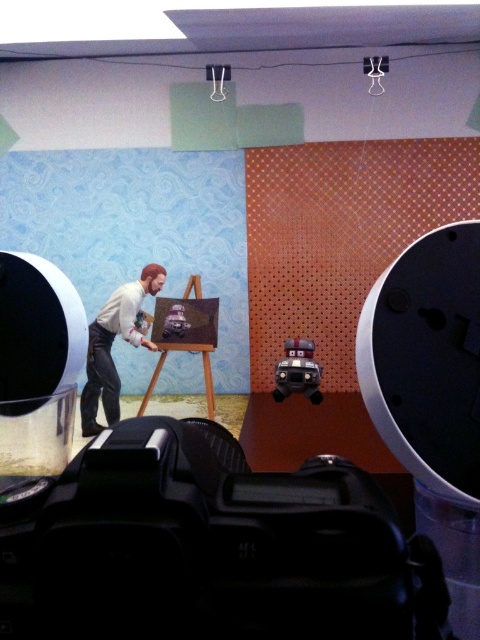
Is smooth beige shirt at center below wooden easel at center?

Incorrect, smooth beige shirt at center is not positioned below wooden easel at center.

Between point (127, 307) and point (166, 330), which one is positioned behind?

The point (166, 330) is more distant.

I want to click on smooth beige shirt at center, so click(x=110, y=346).

Does smooth beige shirt at center appear over matte black video camera at center?

Yes, smooth beige shirt at center is above matte black video camera at center.

Does smooth beige shirt at center have a larger size compared to matte black video camera at center?

Yes.

Is point (99, 376) positioned in front of point (314, 385)?

No.

You are a GUI agent. You are given a task and a screenshot of the screen. Output one action in this format:
    pyautogui.click(x=<x>, y=<y>)
    Task: Click on the smooth beige shirt at center
    The height and width of the screenshot is (640, 480).
    Given the screenshot: What is the action you would take?
    pos(110,346)

Is wooden easel at center positioned in front of matte black video camera at center?

No.

Between point (207, 364) and point (305, 356), which one is positioned behind?

The point (207, 364) is behind.

Which is behind, point (207, 355) or point (312, 358)?

Point (207, 355)

The image size is (480, 640). Identify the location of wooden easel at center. (186, 333).